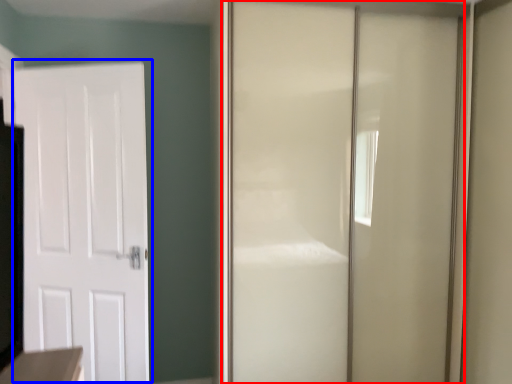
Question: Which point is further to the camera, door (highlighted by a red box) or door (highlighted by a blue box)?

Choices:
 (A) door
 (B) door

Answer: (B)